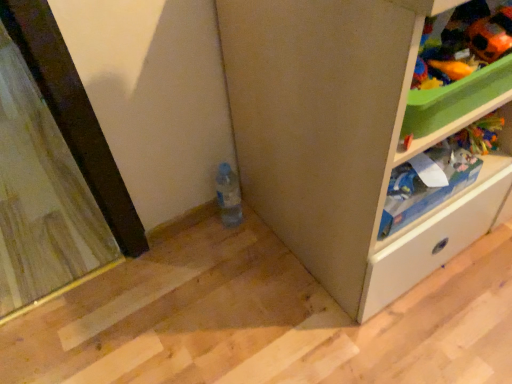
Question: Can you confirm if translucent plastic bottle at lower center is wider than wooden screen door at left?

Choices:
 (A) no
 (B) yes

Answer: (A)

Question: Can you confirm if translucent plastic bottle at lower center is bigger than wooden screen door at left?

Choices:
 (A) no
 (B) yes

Answer: (A)

Question: Considering the relative positions of translucent plastic bottle at lower center and wooden screen door at left in the image provided, is translucent plastic bottle at lower center to the left of wooden screen door at left from the viewer's perspective?

Choices:
 (A) no
 (B) yes

Answer: (A)

Question: Considering the relative sizes of translucent plastic bottle at lower center and wooden screen door at left in the image provided, is translucent plastic bottle at lower center taller than wooden screen door at left?

Choices:
 (A) yes
 (B) no

Answer: (A)

Question: From a real-world perspective, is translucent plastic bottle at lower center located higher than wooden screen door at left?

Choices:
 (A) no
 (B) yes

Answer: (B)

Question: In terms of height, does orange plush toy at upper right, the 2th toy when ordered from right to left, look taller or shorter compared to orange fabric toy at upper right, acting as the 1th toy starting from the right?

Choices:
 (A) short
 (B) tall

Answer: (A)

Question: Is orange plush toy at upper right, the 2th toy when ordered from right to left, wider or thinner than orange fabric toy at upper right, acting as the 1th toy starting from the right?

Choices:
 (A) thin
 (B) wide

Answer: (A)

Question: Is orange plush toy at upper right, the 2th toy when ordered from right to left, to the left or to the right of orange fabric toy at upper right, the 2th toy in the left-to-right sequence, in the image?

Choices:
 (A) left
 (B) right

Answer: (A)

Question: Looking at the image, does orange plush toy at upper right, acting as the first toy starting from the left, seem bigger or smaller compared to orange fabric toy at upper right, the 2th toy in the left-to-right sequence?

Choices:
 (A) big
 (B) small

Answer: (B)

Question: Would you say white plastic shelf at upper right is inside or outside white matte cabinet at lower right?

Choices:
 (A) inside
 (B) outside

Answer: (A)

Question: Looking at their shapes, would you say white plastic shelf at upper right is wider or thinner than white matte cabinet at lower right?

Choices:
 (A) thin
 (B) wide

Answer: (A)

Question: From their relative heights in the image, would you say white plastic shelf at upper right is taller or shorter than white matte cabinet at lower right?

Choices:
 (A) tall
 (B) short

Answer: (B)

Question: Is white plastic shelf at upper right in front of or behind white matte cabinet at lower right in the image?

Choices:
 (A) behind
 (B) front

Answer: (A)

Question: Is orange fabric toy at upper right, the 2th toy in the left-to-right sequence, in front of or behind white matte cabinet at lower right in the image?

Choices:
 (A) front
 (B) behind

Answer: (B)

Question: Looking at their shapes, would you say orange fabric toy at upper right, the 2th toy in the left-to-right sequence, is wider or thinner than white matte cabinet at lower right?

Choices:
 (A) wide
 (B) thin

Answer: (B)